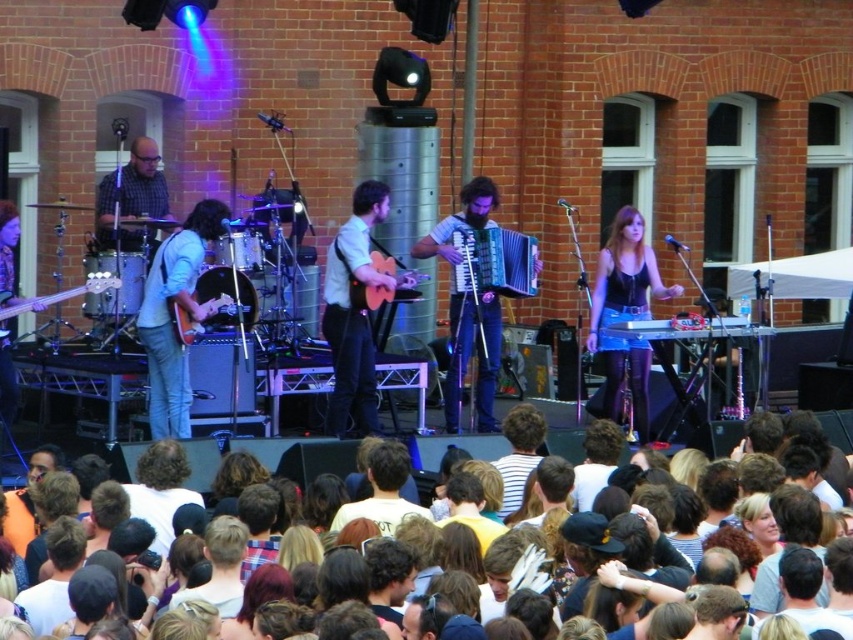
You are a photographer trying to capture the band members in the concert scene. You notice the multicolored casual clothing at lower center and the orange matte guitar at center. Which object is closer to the camera?

The multicolored casual clothing at lower center is closer to the camera because it is in front of the orange matte guitar at center.

You are standing at the center of the stage and want to move towards the multicolored casual clothing at lower center. In which direction should you move?

You should move towards the lower center direction to reach the multicolored casual clothing at lower center since its 2D location is at point (805, 512), which is in the lower center area.

You are a photographer at the concert and want to capture a photo that includes both the metallic silver keyboard at center and the brushed metal guitar at left. Based on their positions, which one should you focus on first to ensure both are in the frame?

The metallic silver keyboard at center is located below the brushed metal guitar at left, so you should focus on the brushed metal guitar at left first to ensure both are in the frame.